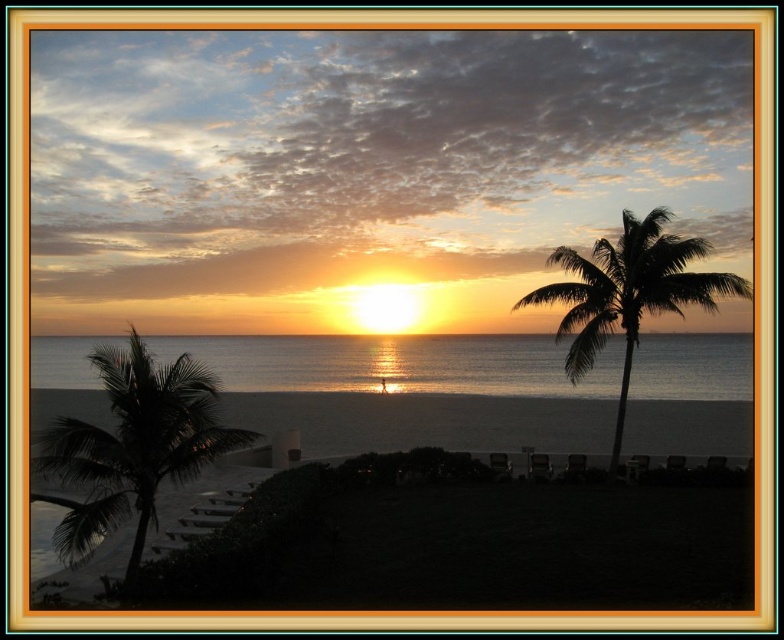
Looking at this image, does green leafy palm tree at lower left have a lesser height compared to silhouette leafy palm at right?

Yes.

From the picture: Who is positioned more to the right, green leafy palm tree at lower left or silhouette leafy palm at right?

From the viewer's perspective, silhouette leafy palm at right appears more on the right side.

In order to click on green leafy palm tree at lower left in this screenshot , I will do `click(131, 448)`.

Is silvery reflective water at center taller than green leafy palm tree at lower left?

In fact, silvery reflective water at center may be shorter than green leafy palm tree at lower left.

Which is more to the left, silvery reflective water at center or green leafy palm tree at lower left?

Positioned to the left is green leafy palm tree at lower left.

Is point (224, 388) positioned before point (56, 461)?

No, (224, 388) is further to viewer.

I want to click on silvery reflective water at center, so click(x=396, y=364).

Image resolution: width=784 pixels, height=640 pixels. What are the coordinates of `silvery reflective water at center` in the screenshot? It's located at (396, 364).

Is silvery reflective water at center positioned at the back of silhouette leafy palm at right?

Yes, it is.

The width and height of the screenshot is (784, 640). In order to click on silvery reflective water at center in this screenshot , I will do `click(396, 364)`.